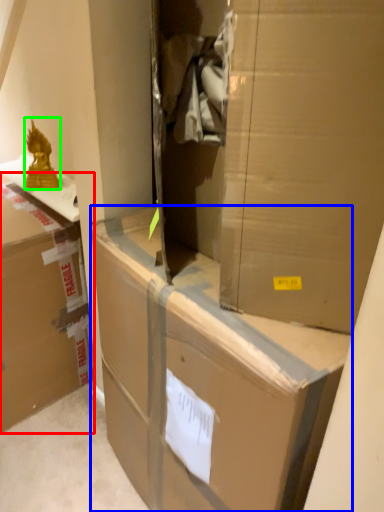
Question: Which is nearer to the box (highlighted by a red box)? box (highlighted by a blue box) or wrap (highlighted by a green box).

Choices:
 (A) box
 (B) wrap

Answer: (B)